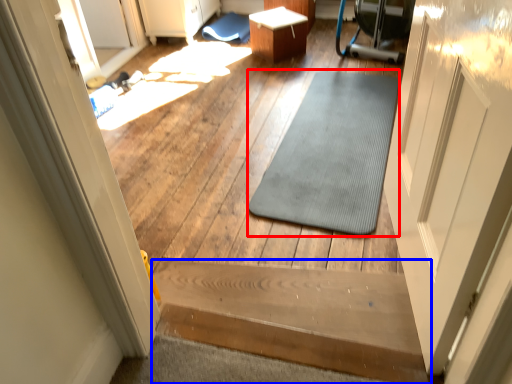
Question: Which point is further to the camera, mat (highlighted by a red box) or stairs (highlighted by a blue box)?

Choices:
 (A) mat
 (B) stairs

Answer: (A)